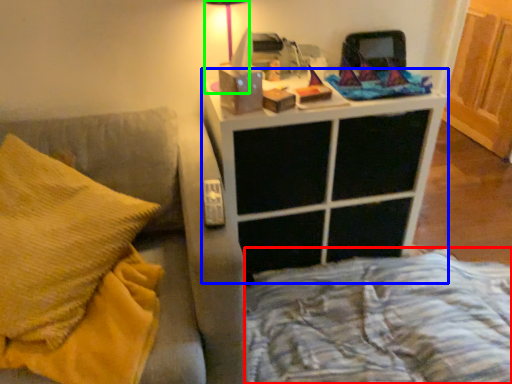
Question: Which object is the farthest from bed frame (highlighted by a red box)? Choose among these: nightstand (highlighted by a blue box) or table lamp (highlighted by a green box).

Choices:
 (A) nightstand
 (B) table lamp

Answer: (B)